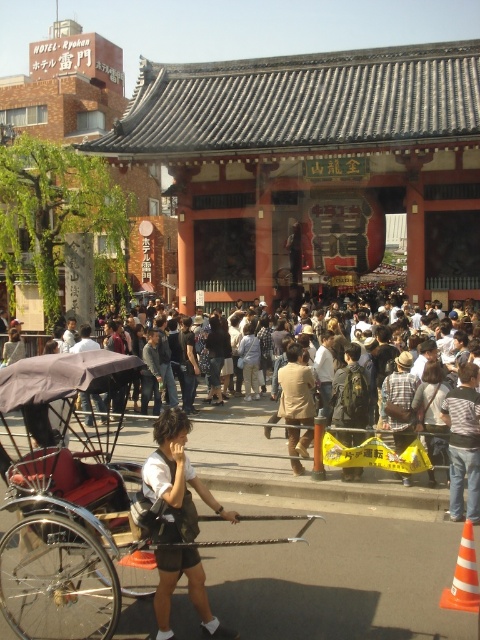
Question: Which point is closer to the camera?

Choices:
 (A) (61, 358)
 (B) (468, 371)
 (C) (197, 604)

Answer: (C)

Question: Does wooden cart at center appear on the left side of white fabric shirt at center?

Choices:
 (A) no
 (B) yes

Answer: (B)

Question: Is white fabric shirt at center to the right of striped shirt at center from the viewer's perspective?

Choices:
 (A) no
 (B) yes

Answer: (A)

Question: Among these points, which one is nearest to the camera?

Choices:
 (A) (457, 483)
 (B) (179, 474)

Answer: (B)

Question: Which of the following is the farthest from the observer?

Choices:
 (A) (472, 492)
 (B) (111, 461)
 (C) (184, 497)

Answer: (B)

Question: Can you confirm if wooden cart at center is wider than striped shirt at center?

Choices:
 (A) yes
 (B) no

Answer: (A)